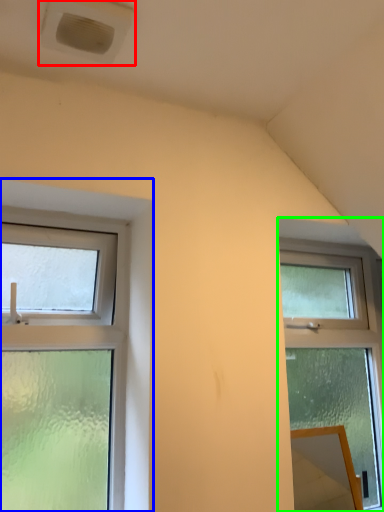
Question: Which is farther away from air conditioning (highlighted by a red box)? window (highlighted by a blue box) or window (highlighted by a green box)?

Choices:
 (A) window
 (B) window

Answer: (B)